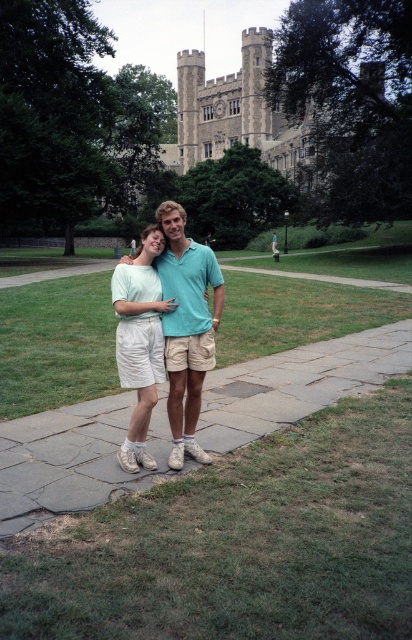
Does gray stone pavement at center lie in front of light blue cotton shirt at center?

No, it is not.

Locate an element on the screen. gray stone pavement at center is located at coordinates click(x=72, y=460).

This screenshot has width=412, height=640. I want to click on gray stone pavement at center, so click(72, 460).